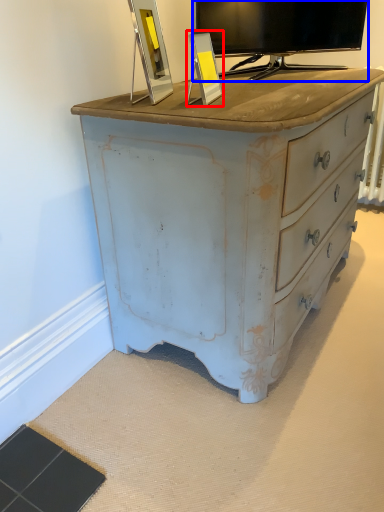
Question: Which of the following is the closest to the observer, picture frame (highlighted by a red box) or television (highlighted by a blue box)?

Choices:
 (A) picture frame
 (B) television

Answer: (A)